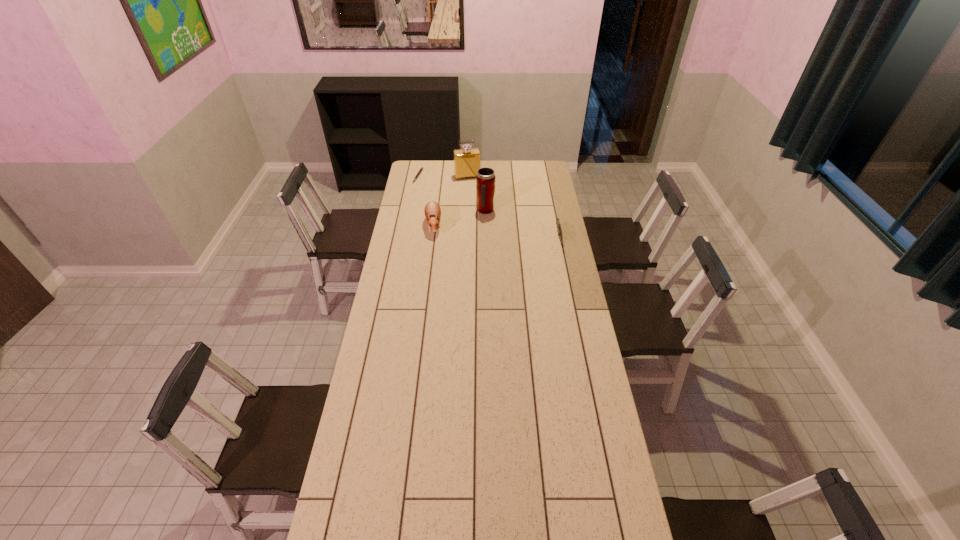
Locate an element on the screen. The width and height of the screenshot is (960, 540). vacant space located 0.110m on the front-facing side of the perfume is located at coordinates (472, 190).

Where is `vacant space located on the front-facing side of the perfume`? vacant space located on the front-facing side of the perfume is located at coordinates (473, 193).

You are a GUI agent. You are given a task and a screenshot of the screen. Output one action in this format:
    pyautogui.click(x=<x>, y=<y>)
    Task: Click on the vacant space located 0.360m on the front-facing side of the perfume
    
    Given the screenshot: What is the action you would take?
    pyautogui.click(x=480, y=215)

Image resolution: width=960 pixels, height=540 pixels. Identify the location of free spot located 0.220m at the nib of the leftmost object. (444, 197).

At what (x,y) coordinates should I click in order to perform the action: click on vacant region located at the nib of the leftmost object. Please return your answer as a coordinate pair (x, y). This screenshot has width=960, height=540. Looking at the image, I should click on [x=425, y=185].

I want to click on free space located at the nib of the leftmost object, so click(435, 191).

The image size is (960, 540). In order to click on vacant region located 0.280m on the side with the handle of the thermos bottle in this screenshot , I will do `click(520, 245)`.

This screenshot has width=960, height=540. In order to click on free space located 0.390m on the side with the handle of the thermos bottle in this screenshot , I will do click(533, 256).

The height and width of the screenshot is (540, 960). Find the location of `vacant space located on the side with the handle of the thermos bottle`. vacant space located on the side with the handle of the thermos bottle is located at coordinates (509, 234).

Find the location of `perfume that is at the far edge`. perfume that is at the far edge is located at coordinates (467, 161).